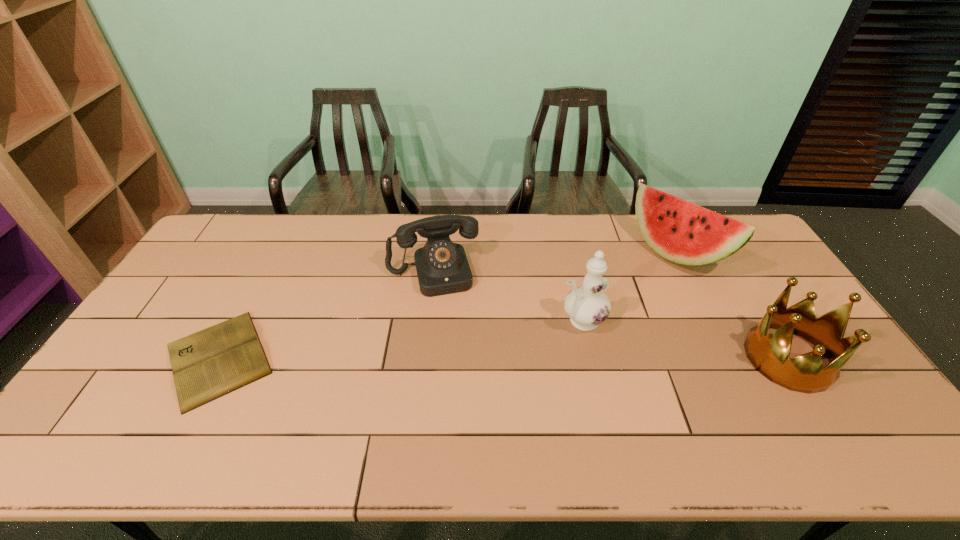
Where is `vacant space located 0.110m on the dial of the fourth object from right to left`? vacant space located 0.110m on the dial of the fourth object from right to left is located at coordinates (446, 323).

The width and height of the screenshot is (960, 540). What are the coordinates of `vacant point located on the dial of the fourth object from right to left` in the screenshot? It's located at (454, 355).

You are a GUI agent. You are given a task and a screenshot of the screen. Output one action in this format:
    pyautogui.click(x=<x>, y=<y>)
    Task: Click on the vacant space located 0.390m on the dial of the fourth object from right to left
    
    Given the screenshot: What is the action you would take?
    pyautogui.click(x=466, y=406)

This screenshot has height=540, width=960. Identify the location of vacant space situated at the spout of the chinaware. coord(512,353).

You are a GUI agent. You are given a task and a screenshot of the screen. Output one action in this format:
    pyautogui.click(x=<x>, y=<y>)
    Task: Click on the free spot located 0.190m at the spout of the chinaware
    This screenshot has width=960, height=540.
    Given the screenshot: What is the action you would take?
    pyautogui.click(x=506, y=356)

Locate an element on the screen. The height and width of the screenshot is (540, 960). vacant space located 0.260m at the spout of the chinaware is located at coordinates (484, 367).

Identify the location of blank space located on the outer rind of the watermelon. This screenshot has width=960, height=540. [x=624, y=305].

I want to click on free space located 0.350m on the outer rind of the watermelon, so click(x=595, y=332).

The height and width of the screenshot is (540, 960). I want to click on free region located 0.120m on the outer rind of the watermelon, so click(x=638, y=293).

At what (x,y) coordinates should I click in order to perform the action: click on telephone present at the far edge. Please return your answer as a coordinate pair (x, y). The width and height of the screenshot is (960, 540). Looking at the image, I should click on (442, 267).